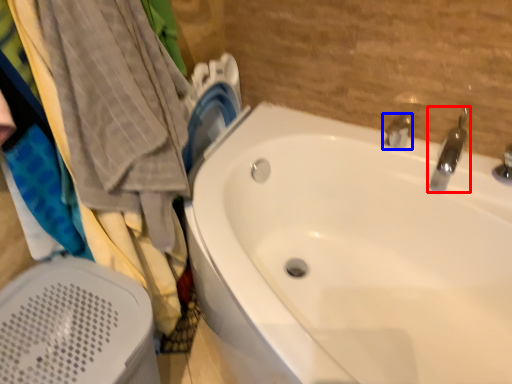
Question: Which object appears farthest to the camera in this image, tap (highlighted by a red box) or tap (highlighted by a blue box)?

Choices:
 (A) tap
 (B) tap

Answer: (B)